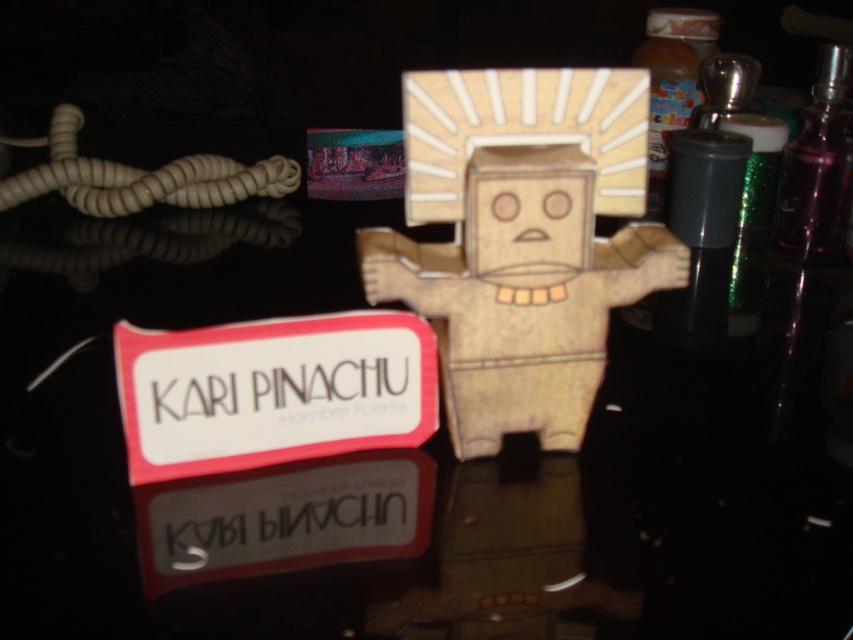
Question: Can you confirm if wooden figure at center is positioned below metallic purple bottle at upper right?

Choices:
 (A) no
 (B) yes

Answer: (B)

Question: Which point appears closest to the camera in this image?

Choices:
 (A) (526, 220)
 (B) (834, 96)

Answer: (A)

Question: Can you confirm if wooden figure at center is thinner than metallic purple bottle at upper right?

Choices:
 (A) yes
 (B) no

Answer: (B)

Question: Which point is farther from the camera taking this photo?

Choices:
 (A) (602, 106)
 (B) (840, 68)

Answer: (B)

Question: Is wooden figure at center to the left of metallic purple bottle at upper right from the viewer's perspective?

Choices:
 (A) no
 (B) yes

Answer: (B)